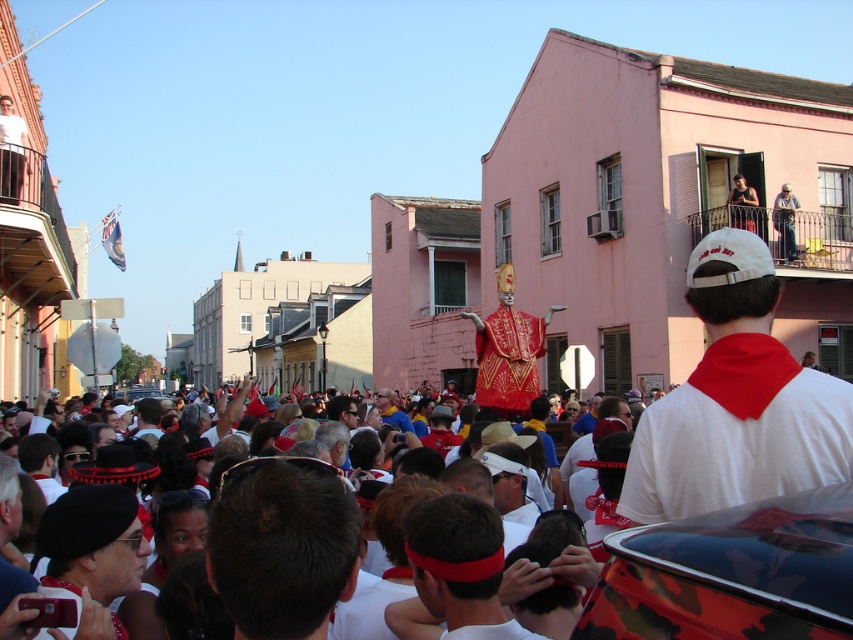
Can you confirm if white fabric at upper right is taller than camouflage-patterned car at center?

Correct, white fabric at upper right is much taller as camouflage-patterned car at center.

Between white fabric at upper right and camouflage-patterned car at center, which one has less height?

With less height is camouflage-patterned car at center.

Locate an element on the screen. The width and height of the screenshot is (853, 640). white fabric at upper right is located at coordinates tap(735, 401).

Is point (512, 492) less distant than point (515, 369)?

Yes, it is in front of point (515, 369).

Describe the element at coordinates (612, 452) in the screenshot. I see `white cotton crowd at center` at that location.

Is point (614, 476) behind point (531, 316)?

No.

Where is `white cotton crowd at center`? This screenshot has height=640, width=853. white cotton crowd at center is located at coordinates (612, 452).

Is white cotton crowd at center below dark brown leather jacket at upper right?

Yes, white cotton crowd at center is below dark brown leather jacket at upper right.

Image resolution: width=853 pixels, height=640 pixels. I want to click on white cotton crowd at center, so click(x=612, y=452).